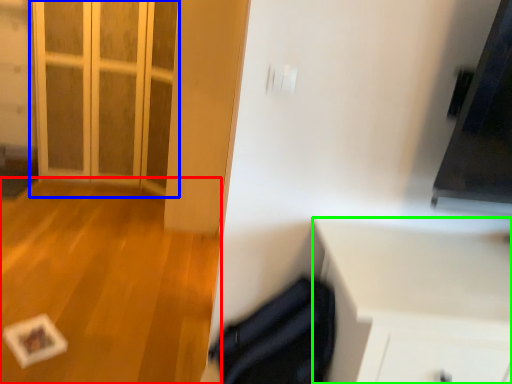
Question: Based on their relative distances, which object is nearer to plain (highlighted by a red box)? Choose from door (highlighted by a blue box) and cabinetry (highlighted by a green box).

Choices:
 (A) door
 (B) cabinetry

Answer: (A)